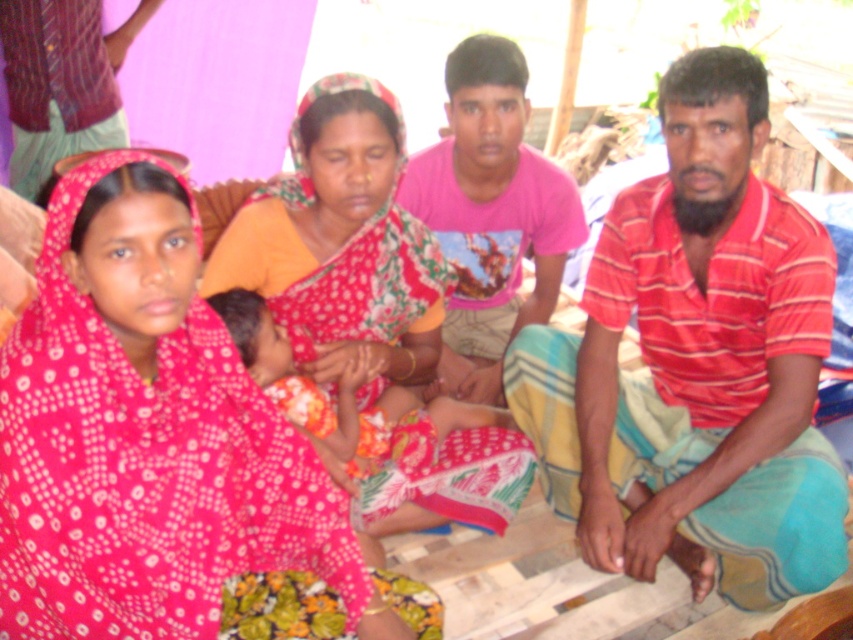
What is the color of the clothing item located at the coordinates point (695, 364) in the image?

The point (695, 364) marks the red striped shirt at center.

You are a photographer setting up a shoot in the described scene. You need to place a small prop between the polka dot fabric sari at center and the pink cotton shirt at center. Based on their positions, where should you place the prop to ensure it is between them?

The polka dot fabric sari at center is below the pink cotton shirt at center, so placing the prop between them would require positioning it above the polka dot fabric sari at center and below the pink cotton shirt at center.